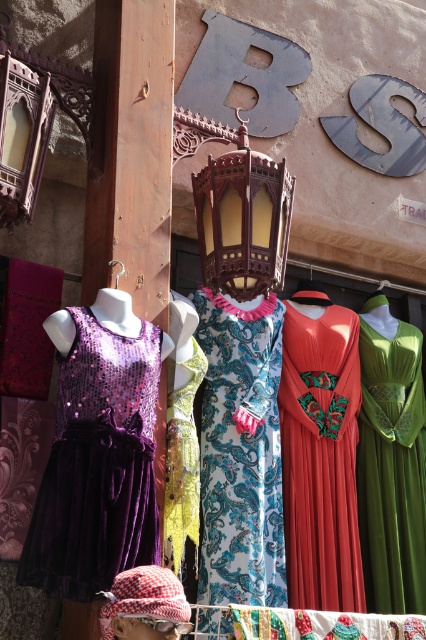
Question: Among these objects, which one is nearest to the camera?

Choices:
 (A) blue paisley fabric dress at center
 (B) shiny red dress at center
 (C) green velvet dress at center

Answer: (A)

Question: Does shiny purple velvet dress at left have a larger size compared to blue paisley fabric dress at center?

Choices:
 (A) yes
 (B) no

Answer: (B)

Question: Can you confirm if blue paisley fabric dress at center is wider than yellow sequined dress at center?

Choices:
 (A) yes
 (B) no

Answer: (A)

Question: Does shiny purple velvet dress at left have a lesser width compared to green velvet dress at center?

Choices:
 (A) no
 (B) yes

Answer: (B)

Question: Which of these objects is positioned farthest from the yellow sequined dress at center?

Choices:
 (A) green velvet dress at center
 (B) shiny purple velvet dress at left

Answer: (A)

Question: Which object is farther from the camera taking this photo?

Choices:
 (A) blue paisley fabric dress at center
 (B) yellow sequined dress at center

Answer: (A)